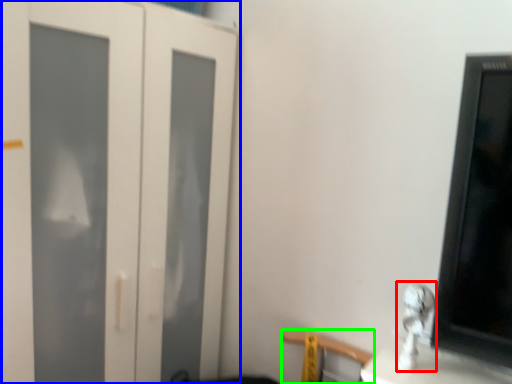
Question: Which object is the farthest from silver (highlighted by a red box)? Choose among these: door (highlighted by a blue box) or chair (highlighted by a green box).

Choices:
 (A) door
 (B) chair

Answer: (A)